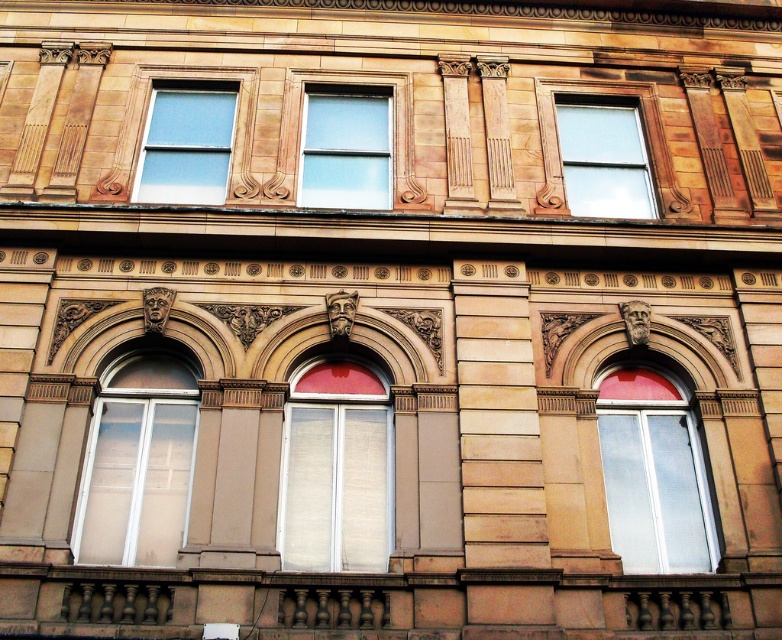
You are standing in front of the building and want to determine the relative positions of two points marked on the facade. Which point is closer to you, point 1 at coordinates (303, 492) or point 2 at coordinates (345, 125)?

Point 1 at coordinates (303, 492) is closer to the viewer than point 2 at coordinates (345, 125).

You are an architect reviewing the building facade. You notice two windows at the center of the upper section. The white glass window at center and the clear glass window at center. Which one has a greater width?

The white glass window at center has a greater width than the clear glass window at center according to the description.

You are a maintenance worker needing to inspect both the white matte window at center and the matte glass window at upper center. Given that your ladder can extend up to 50 feet, will you be able to reach both windows with the ladder?

The distance between the white matte window at center and the matte glass window at upper center is 52.90 feet, so the ladder can only reach up to 50 feet. Therefore, you will not be able to reach both windows with the ladder.